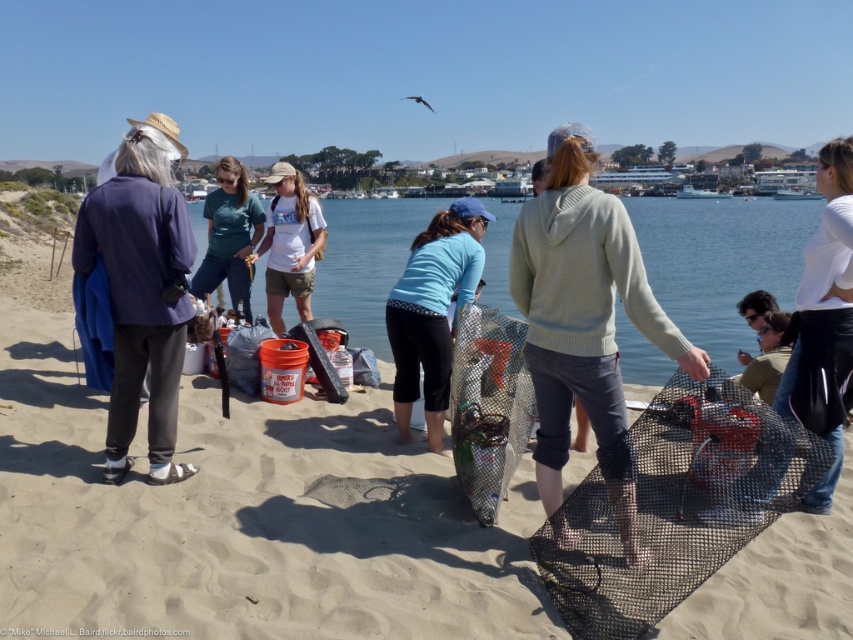
You are standing on the beach and see a point at coordinates (531, 323). If you want to place a 10 feet long banner horizontally from this point, will it fit within the beach area without going into the water?

The point at coordinates (531, 323) is 13.22 feet away from the viewer. Since the banner is 10 feet long, it can be placed horizontally from this point within the beach area as there is sufficient space before reaching the water.

You are a photographer trying to capture a group photo of the white matte shirt at upper right and the green fabric shirt at lower right. If you want to ensure both shirts are fully visible in the frame, which one should you focus on first?

The white matte shirt at upper right might be wider than green fabric shirt at lower right, so you should focus on the white matte shirt at upper right first to ensure it fits within the frame.